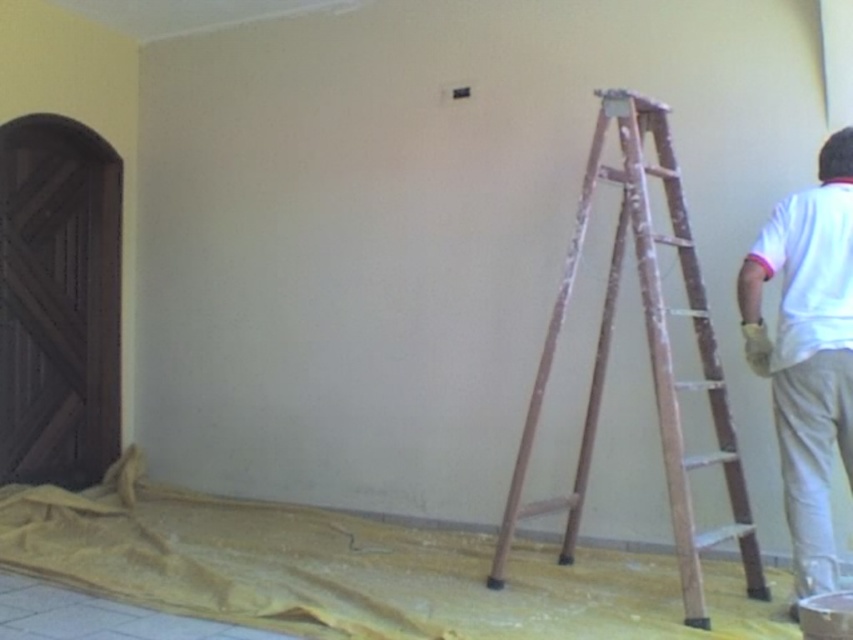
You are a painter who needs to place a 1.2 meter wide painting on the wall. The wooden ladder at right and the white matte shirt at right are in the way. Which object must you move first to make space?

The wooden ladder at right must be moved first because its width is larger than the white matte shirt at right, so it occupies more space and needs to be relocated to accommodate the 1.2 meter wide painting.

You are a painter who needs to reach a high spot on the wall. You see a wooden ladder at right and a white matte shirt at right. Which object is taller and can help you reach the high spot?

The wooden ladder at right is taller than the white matte shirt at right, so it can help you reach the high spot.